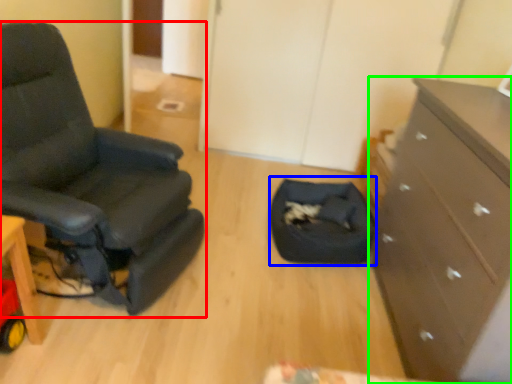
Question: Which object is positioned farthest from chair (highlighted by a red box)? Select from footrest (highlighted by a blue box) and chest of drawers (highlighted by a green box).

Choices:
 (A) footrest
 (B) chest of drawers

Answer: (B)